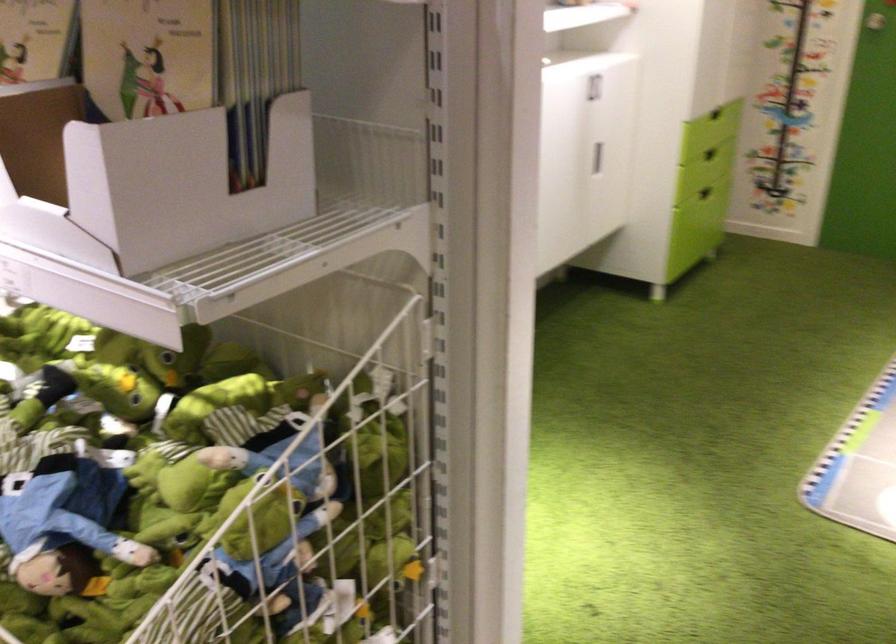
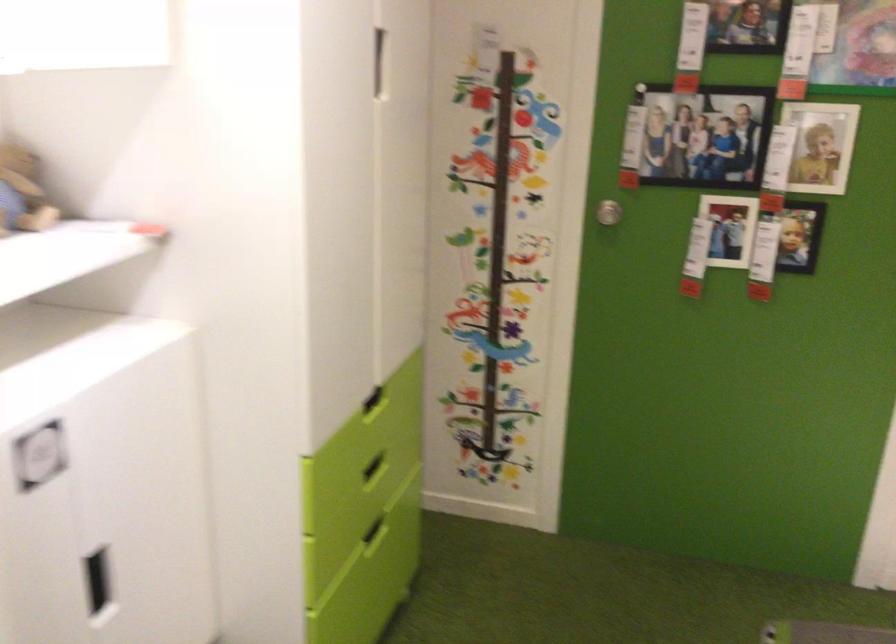
In the second image, find the point that corresponds to point 717,185 in the first image.

(375, 531)